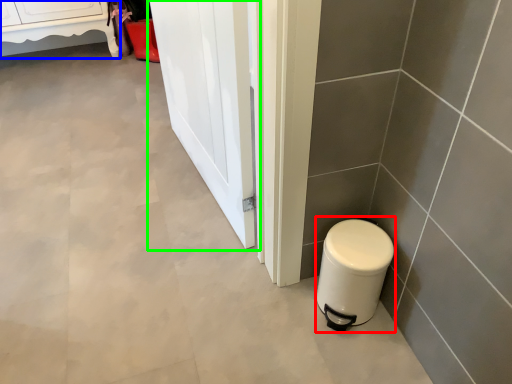
Question: Which object is the closest to the appliance (highlighted by a red box)? Choose among these: furniture (highlighted by a blue box) or screen door (highlighted by a green box).

Choices:
 (A) furniture
 (B) screen door

Answer: (B)